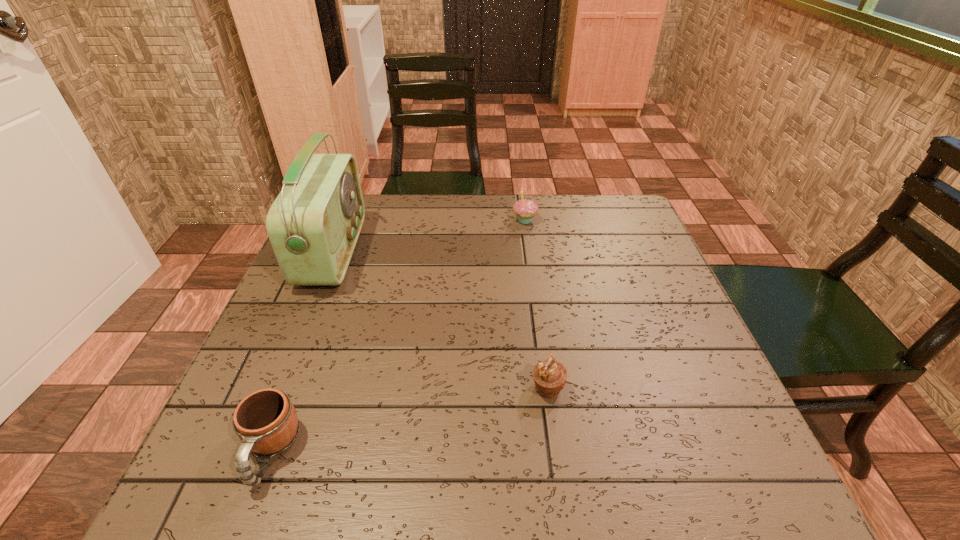
At what (x,y) coordinates should I click in order to perform the action: click on the tallest object. Please return your answer as a coordinate pair (x, y). This screenshot has width=960, height=540. Looking at the image, I should click on (313, 225).

Find the location of a particular element. cupcake is located at coordinates (525, 209).

Find the location of a particular element. the second nearest object is located at coordinates click(549, 376).

Locate an element on the screen. the nearest object is located at coordinates (266, 422).

Locate an element on the screen. This screenshot has height=540, width=960. free space located on the front panel of the radio receiver is located at coordinates (423, 252).

This screenshot has width=960, height=540. What are the coordinates of `vacant space located on the left of the cupcake` in the screenshot? It's located at (473, 220).

Find the location of `free space located 0.110m on the back of the muffin`. free space located 0.110m on the back of the muffin is located at coordinates (540, 333).

Where is `radio receiver situated at the far edge`? The image size is (960, 540). radio receiver situated at the far edge is located at coordinates (313, 225).

Identify the location of cupcake at the far edge. (525, 209).

Locate an element on the screen. The width and height of the screenshot is (960, 540). object at the near edge is located at coordinates (266, 422).